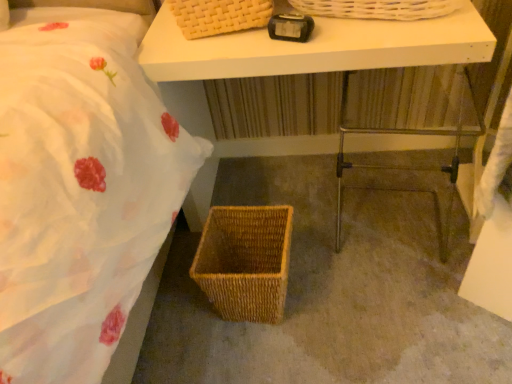
Where is `white matte table at upper center`? The height and width of the screenshot is (384, 512). white matte table at upper center is located at coordinates (329, 82).

The height and width of the screenshot is (384, 512). What do you see at coordinates (329, 82) in the screenshot?
I see `white matte table at upper center` at bounding box center [329, 82].

The image size is (512, 384). I want to click on woven brown picnic basket at lower center, so click(245, 261).

Locate an element on the screen. The image size is (512, 384). white matte table at upper center is located at coordinates (329, 82).

Which is in front, point (285, 19) or point (331, 137)?

Point (285, 19)

Which of these two, black plastic alarm clock at upper center or white matte table at upper center, is bigger?

white matte table at upper center is bigger.

Would you consider black plastic alarm clock at upper center to be distant from white matte table at upper center?

black plastic alarm clock at upper center is near white matte table at upper center, not far away.

Based on the photo, from a real-world perspective, relative to white matte table at upper center, is black plastic alarm clock at upper center vertically above or below?

black plastic alarm clock at upper center is situated higher than white matte table at upper center in the real world.

Is white matte table at upper center completely or partially outside of woven brown picnic basket at lower center?

Yes, white matte table at upper center is located beyond the bounds of woven brown picnic basket at lower center.

How many degrees apart are the facing directions of white matte table at upper center and woven brown picnic basket at lower center?

The angular difference between white matte table at upper center and woven brown picnic basket at lower center is 2.78 degrees.

Is white matte table at upper center oriented towards woven brown picnic basket at lower center?

Yes.

From a real-world perspective, which is physically above, white matte table at upper center or woven brown picnic basket at lower center?

In real-world perspective, white matte table at upper center is above.

How far apart are brown woven basket at lower center and woven brown picnic basket at lower center?

brown woven basket at lower center is 9.75 inches away from woven brown picnic basket at lower center.

Is brown woven basket at lower center outside of woven brown picnic basket at lower center?

Indeed, brown woven basket at lower center is completely outside woven brown picnic basket at lower center.

From the image's perspective, which is below, brown woven basket at lower center or woven brown picnic basket at lower center?

woven brown picnic basket at lower center is shown below in the image.

Is brown woven basket at lower center closer to the viewer compared to woven brown picnic basket at lower center?

Yes, brown woven basket at lower center is in front of woven brown picnic basket at lower center.

Which is more to the right, woven brown picnic basket at lower center or black plastic alarm clock at upper center?

black plastic alarm clock at upper center is more to the right.

Which object is wider, woven brown picnic basket at lower center or black plastic alarm clock at upper center?

woven brown picnic basket at lower center is wider.

Are woven brown picnic basket at lower center and black plastic alarm clock at upper center far apart?

No, there isn't a large distance between woven brown picnic basket at lower center and black plastic alarm clock at upper center.

From a real-world perspective, who is located higher, woven brown picnic basket at lower center or black plastic alarm clock at upper center?

black plastic alarm clock at upper center, from a real-world perspective.

Between black plastic alarm clock at upper center and woven brown picnic basket at lower center, which one appears on the right side from the viewer's perspective?

From the viewer's perspective, black plastic alarm clock at upper center appears more on the right side.

Is black plastic alarm clock at upper center oriented away from woven brown picnic basket at lower center?

No, woven brown picnic basket at lower center is not at the back of black plastic alarm clock at upper center.

Would you say black plastic alarm clock at upper center is a long distance from woven brown picnic basket at lower center?

No, black plastic alarm clock at upper center is not far from woven brown picnic basket at lower center.

Can you confirm if black plastic alarm clock at upper center is taller than woven brown picnic basket at lower center?

In fact, black plastic alarm clock at upper center may be shorter than woven brown picnic basket at lower center.

From a real-world perspective, is white matte table at upper center positioned under metallic silver step stool at lower right based on gravity?

No, from a real-world perspective, white matte table at upper center is not beneath metallic silver step stool at lower right.

Based on their sizes in the image, would you say white matte table at upper center is bigger or smaller than metallic silver step stool at lower right?

Clearly, white matte table at upper center is larger in size than metallic silver step stool at lower right.

From the image's perspective, is white matte table at upper center under metallic silver step stool at lower right?

Actually, white matte table at upper center appears above metallic silver step stool at lower right in the image.

Does white matte table at upper center have a lesser height compared to metallic silver step stool at lower right?

No.

Consider the image. From a real-world perspective, who is located lower, woven brown picnic basket at lower center or brown woven basket at lower center?

brown woven basket at lower center is physically lower.

In terms of size, does woven brown picnic basket at lower center appear bigger or smaller than brown woven basket at lower center?

woven brown picnic basket at lower center is smaller than brown woven basket at lower center.

Is brown woven basket at lower center surrounded by woven brown picnic basket at lower center?

Actually, brown woven basket at lower center is outside woven brown picnic basket at lower center.

You are a GUI agent. You are given a task and a screenshot of the screen. Output one action in this format:
    pyautogui.click(x=<x>, y=<y>)
    Task: Click on the alarm clock above the white matte table at upper center (from a real-world perspective)
    Image resolution: width=512 pixels, height=384 pixels.
    Given the screenshot: What is the action you would take?
    pyautogui.click(x=290, y=27)

What are the coordinates of `table above the woven brown picnic basket at lower center (from the image's perspective)` in the screenshot? It's located at (329, 82).

Looking at the image, which one is located closer to metallic silver step stool at lower right, woven brown picnic basket at lower center or black plastic alarm clock at upper center?

woven brown picnic basket at lower center.

Looking at the image, which one is located closer to woven brown picnic basket at lower center, metallic silver step stool at lower right or white matte table at upper center?

Based on the image, metallic silver step stool at lower right appears to be nearer to woven brown picnic basket at lower center.

From the picture: When comparing their distances from black plastic alarm clock at upper center, does brown woven basket at lower center or white matte table at upper center seem further?

brown woven basket at lower center lies further to black plastic alarm clock at upper center than the other object.

Estimate the real-world distances between objects in this image. Which object is further from black plastic alarm clock at upper center, white matte table at upper center or brown woven basket at lower center?

brown woven basket at lower center is positioned further to the anchor black plastic alarm clock at upper center.

Considering their positions, is woven brown picnic basket at lower center positioned further to white matte table at upper center than black plastic alarm clock at upper center?

woven brown picnic basket at lower center is further to white matte table at upper center.

Which object lies further to the anchor point white matte table at upper center, metallic silver step stool at lower right or woven brown picnic basket at lower center?

woven brown picnic basket at lower center is further to white matte table at upper center.

From the image, which object appears to be farther from black plastic alarm clock at upper center, metallic silver step stool at lower right or white matte table at upper center?

Among the two, metallic silver step stool at lower right is located further to black plastic alarm clock at upper center.

Which object lies further to the anchor point black plastic alarm clock at upper center, woven brown picnic basket at lower center or brown woven basket at lower center?

brown woven basket at lower center is positioned further to the anchor black plastic alarm clock at upper center.

Find the location of a particular element. The image size is (512, 384). table between black plastic alarm clock at upper center and woven brown picnic basket at lower center vertically is located at coordinates (329, 82).

Image resolution: width=512 pixels, height=384 pixels. Identify the location of table between black plastic alarm clock at upper center and metallic silver step stool at lower right in the horizontal direction. (329, 82).

The image size is (512, 384). Identify the location of step stool between white matte table at upper center and brown woven basket at lower center in the vertical direction. (408, 134).

The image size is (512, 384). Find the location of `step stool between white matte table at upper center and woven brown picnic basket at lower center in the vertical direction`. step stool between white matte table at upper center and woven brown picnic basket at lower center in the vertical direction is located at coordinates (408, 134).